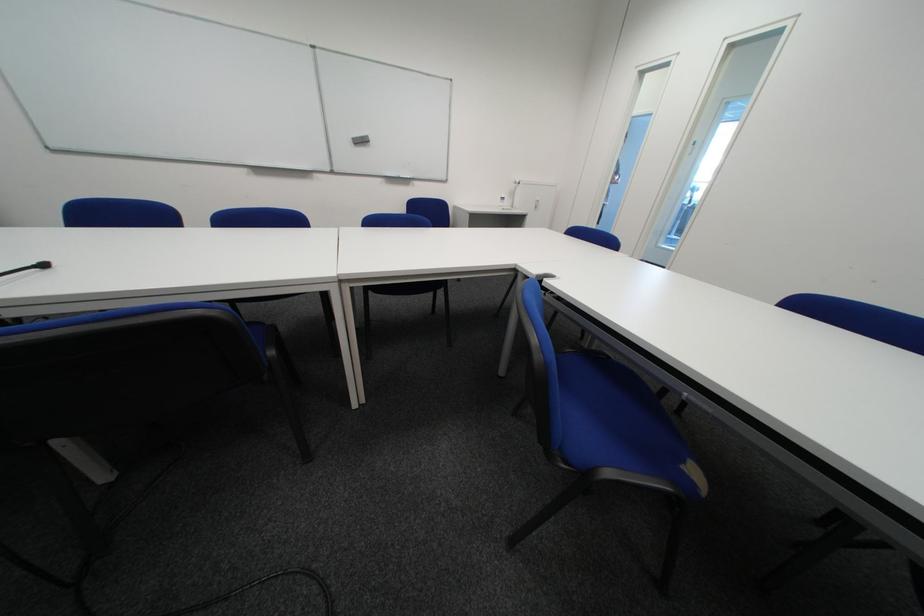
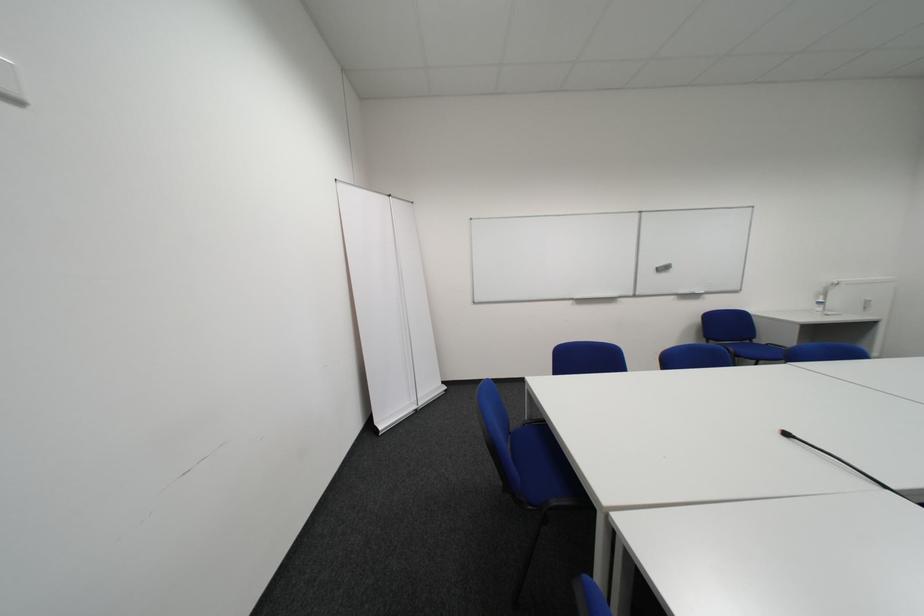
Where in the second image is the point corresponding to point 365,140 from the first image?

(669, 270)